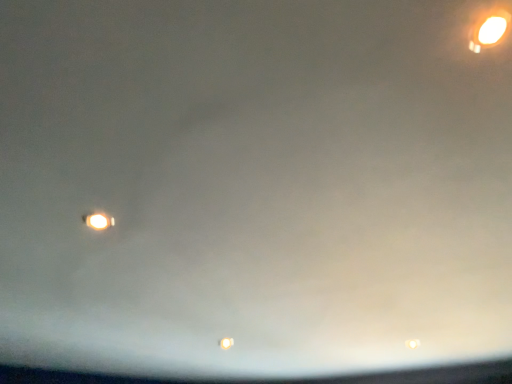
In order to face matte yellow street light at lower left, which is the second street light from right to left, should I rotate leftwards or rightwards?

You should look left and rotate roughly 19.541 degrees.

Where is `matte yellow street light at lower left, acting as the 2th street light starting from the front`? This screenshot has height=384, width=512. matte yellow street light at lower left, acting as the 2th street light starting from the front is located at coordinates (98, 221).

The width and height of the screenshot is (512, 384). What do you see at coordinates (98, 221) in the screenshot? I see `matte yellow street light at lower left, which is counted as the 1th street light, starting from the left` at bounding box center [98, 221].

The height and width of the screenshot is (384, 512). Identify the location of matte yellow street light at upper right, the 1th street light viewed from the right. (489, 31).

This screenshot has height=384, width=512. Describe the element at coordinates (489, 31) in the screenshot. I see `matte yellow street light at upper right, which is the 1th street light in front-to-back order` at that location.

Find the location of a particular element. This screenshot has width=512, height=384. matte yellow street light at lower left, which is the second street light from right to left is located at coordinates (98, 221).

Looking at this image, which object is positioned more to the left, matte yellow street light at upper right, the 1th street light viewed from the right, or matte yellow street light at lower left, placed as the first street light when sorted from bottom to top?

From the viewer's perspective, matte yellow street light at lower left, placed as the first street light when sorted from bottom to top, appears more on the left side.

Is matte yellow street light at upper right, which is the 1th street light in front-to-back order, positioned in front of matte yellow street light at lower left, placed as the first street light when sorted from bottom to top?

Yes, the depth of matte yellow street light at upper right, which is the 1th street light in front-to-back order, is less than that of matte yellow street light at lower left, placed as the first street light when sorted from bottom to top.

Which point is more distant from viewer, [489,28] or [90,224]?

The point [90,224] is more distant.

From the image's perspective, is matte yellow street light at upper right, the 2th street light in the back-to-front sequence, on matte yellow street light at lower left, which is counted as the 1th street light, starting from the left?

Yes.

From a real-world perspective, which object rests below the other?

In real-world perspective, matte yellow street light at lower left, which is the 2th street light in top-to-bottom order, is lower.

Which of these two, matte yellow street light at upper right, the second street light from the bottom, or matte yellow street light at lower left, the first street light positioned from the back, is wider?

matte yellow street light at lower left, the first street light positioned from the back.

Between matte yellow street light at upper right, the second street light from the bottom, and matte yellow street light at lower left, which is the 2th street light in top-to-bottom order, which one has less height?

matte yellow street light at lower left, which is the 2th street light in top-to-bottom order.

Which of these two, matte yellow street light at upper right, which is the 2th street light in left-to-right order, or matte yellow street light at lower left, the first street light positioned from the back, is smaller?

With smaller size is matte yellow street light at lower left, the first street light positioned from the back.

Do you think matte yellow street light at upper right, the second street light from the bottom, is within matte yellow street light at lower left, placed as the first street light when sorted from bottom to top, or outside of it?

matte yellow street light at upper right, the second street light from the bottom, is spatially situated outside matte yellow street light at lower left, placed as the first street light when sorted from bottom to top.

Based on the photo, are matte yellow street light at upper right, the 2th street light in the back-to-front sequence, and matte yellow street light at lower left, the first street light positioned from the back, located far from each other?

That's right, there is a large distance between matte yellow street light at upper right, the 2th street light in the back-to-front sequence, and matte yellow street light at lower left, the first street light positioned from the back.

Is matte yellow street light at upper right, the second street light from the bottom, facing away from matte yellow street light at lower left, which is counted as the 1th street light, starting from the left?

No, matte yellow street light at upper right, the second street light from the bottom,'s orientation is not away from matte yellow street light at lower left, which is counted as the 1th street light, starting from the left.

Can you tell me how much matte yellow street light at upper right, which is the 1th street light in top-to-bottom order, and matte yellow street light at lower left, which is counted as the 1th street light, starting from the left, differ in facing direction?

51.8 degrees separate the facing orientations of matte yellow street light at upper right, which is the 1th street light in top-to-bottom order, and matte yellow street light at lower left, which is counted as the 1th street light, starting from the left.

The image size is (512, 384). What are the coordinates of `street light lying on the right of matte yellow street light at lower left, acting as the 2th street light starting from the front` in the screenshot? It's located at (489, 31).

Is matte yellow street light at lower left, placed as the first street light when sorted from bottom to top, to the left of matte yellow street light at upper right, the 2th street light in the back-to-front sequence, from the viewer's perspective?

Correct, you'll find matte yellow street light at lower left, placed as the first street light when sorted from bottom to top, to the left of matte yellow street light at upper right, the 2th street light in the back-to-front sequence.

Is matte yellow street light at lower left, acting as the 2th street light starting from the front, further to the viewer compared to matte yellow street light at upper right, the second street light from the bottom?

Yes.

Is point (92, 214) in front of point (482, 23)?

That is False.

From the image's perspective, which is above, matte yellow street light at lower left, placed as the first street light when sorted from bottom to top, or matte yellow street light at upper right, the 1th street light viewed from the right?

matte yellow street light at upper right, the 1th street light viewed from the right, appears higher in the image.

From a real-world perspective, is matte yellow street light at lower left, acting as the 2th street light starting from the front, over matte yellow street light at upper right, the 2th street light in the back-to-front sequence?

No.

Is matte yellow street light at lower left, placed as the first street light when sorted from bottom to top, thinner than matte yellow street light at upper right, which is the 1th street light in top-to-bottom order?

No, matte yellow street light at lower left, placed as the first street light when sorted from bottom to top, is not thinner than matte yellow street light at upper right, which is the 1th street light in top-to-bottom order.

Considering the relative sizes of matte yellow street light at lower left, which is the 2th street light in top-to-bottom order, and matte yellow street light at upper right, which is the 2th street light in left-to-right order, in the image provided, is matte yellow street light at lower left, which is the 2th street light in top-to-bottom order, taller than matte yellow street light at upper right, which is the 2th street light in left-to-right order,?

No, matte yellow street light at lower left, which is the 2th street light in top-to-bottom order, is not taller than matte yellow street light at upper right, which is the 2th street light in left-to-right order.

Between matte yellow street light at lower left, which is the second street light from right to left, and matte yellow street light at upper right, the 1th street light viewed from the right, which one has smaller size?

With smaller size is matte yellow street light at lower left, which is the second street light from right to left.

Is matte yellow street light at upper right, which is the 2th street light in left-to-right order, completely or partially inside matte yellow street light at lower left, acting as the 2th street light starting from the front?

No, matte yellow street light at upper right, which is the 2th street light in left-to-right order, is not a part of matte yellow street light at lower left, acting as the 2th street light starting from the front.

Is matte yellow street light at lower left, placed as the first street light when sorted from bottom to top, next to matte yellow street light at upper right, which is the 1th street light in front-to-back order, and touching it?

No, matte yellow street light at lower left, placed as the first street light when sorted from bottom to top, is not touching matte yellow street light at upper right, which is the 1th street light in front-to-back order.

From the picture: Is matte yellow street light at upper right, the 2th street light in the back-to-front sequence, at the back of matte yellow street light at lower left, which is the 2th street light in top-to-bottom order?

No, matte yellow street light at lower left, which is the 2th street light in top-to-bottom order, is not facing away from matte yellow street light at upper right, the 2th street light in the back-to-front sequence.

At what (x,y) coordinates should I click in order to perform the action: click on street light that appears above the matte yellow street light at lower left, which is the 2th street light in top-to-bottom order (from a real-world perspective). Please return your answer as a coordinate pair (x, y). This screenshot has width=512, height=384. Looking at the image, I should click on (489, 31).

Identify the location of street light directly beneath the matte yellow street light at upper right, the 2th street light in the back-to-front sequence (from a real-world perspective). (98, 221).

Locate an element on the screen. The height and width of the screenshot is (384, 512). street light in front of the matte yellow street light at lower left, which is counted as the 1th street light, starting from the left is located at coordinates (489, 31).